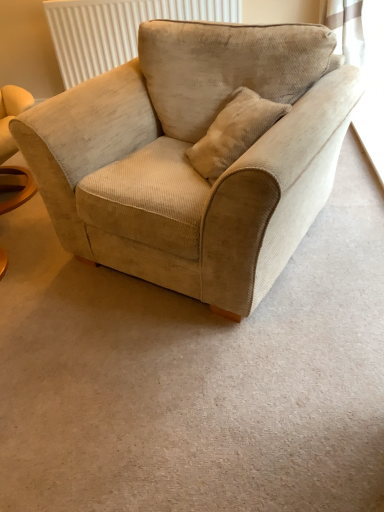
This screenshot has height=512, width=384. What do you see at coordinates (187, 161) in the screenshot? I see `beige corduroy armchair at center` at bounding box center [187, 161].

What are the coordinates of `beige corduroy armchair at center` in the screenshot? It's located at (187, 161).

In order to click on white textured radiator at upper center in this screenshot , I will do `click(117, 29)`.

This screenshot has height=512, width=384. What do you see at coordinates (117, 29) in the screenshot? I see `white textured radiator at upper center` at bounding box center [117, 29].

The image size is (384, 512). In order to click on beige corduroy armchair at center in this screenshot , I will do coord(187,161).

Which is more to the right, white textured radiator at upper center or beige corduroy armchair at center?

beige corduroy armchair at center.

Is white textured radiator at upper center positioned in front of beige corduroy armchair at center?

No.

Is point (135, 28) positioned before point (316, 209)?

No, (135, 28) is further to viewer.

From the image's perspective, relative to beige corduroy armchair at center, is white textured radiator at upper center above or below?

white textured radiator at upper center is situated higher than beige corduroy armchair at center in the image.

From a real-world perspective, which is physically below, white textured radiator at upper center or beige corduroy armchair at center?

In real-world perspective, beige corduroy armchair at center is lower.

Considering the relative sizes of white textured radiator at upper center and beige corduroy armchair at center in the image provided, is white textured radiator at upper center wider than beige corduroy armchair at center?

No.

Who is taller, white textured radiator at upper center or beige corduroy armchair at center?

With more height is beige corduroy armchair at center.

Can you confirm if white textured radiator at upper center is smaller than beige corduroy armchair at center?

Indeed, white textured radiator at upper center has a smaller size compared to beige corduroy armchair at center.

Is white textured radiator at upper center inside the boundaries of beige corduroy armchair at center, or outside?

The correct answer is: outside.

Is white textured radiator at upper center positioned far away from beige corduroy armchair at center?

Indeed, white textured radiator at upper center is not near beige corduroy armchair at center.

Does white textured radiator at upper center turn towards beige corduroy armchair at center?

Yes, white textured radiator at upper center is facing beige corduroy armchair at center.

How many degrees apart are the facing directions of white textured radiator at upper center and beige corduroy armchair at center?

25.7 degrees separate the facing orientations of white textured radiator at upper center and beige corduroy armchair at center.

How distant is white textured radiator at upper center from beige corduroy armchair at center?

white textured radiator at upper center and beige corduroy armchair at center are 1.66 meters apart.

Locate an element on the screen. chair in front of the white textured radiator at upper center is located at coordinates (187, 161).

Is beige corduroy armchair at center at the left side of white textured radiator at upper center?

Incorrect, beige corduroy armchair at center is not on the left side of white textured radiator at upper center.

Is beige corduroy armchair at center positioned before white textured radiator at upper center?

Yes, the depth of beige corduroy armchair at center is less than that of white textured radiator at upper center.

Between point (148, 129) and point (143, 6), which one is positioned in front?

Positioned in front is point (148, 129).

From the image's perspective, which is above, beige corduroy armchair at center or white textured radiator at upper center?

white textured radiator at upper center appears higher in the image.

From a real-world perspective, is beige corduroy armchair at center positioned over white textured radiator at upper center based on gravity?

No.

Is beige corduroy armchair at center wider or thinner than white textured radiator at upper center?

In the image, beige corduroy armchair at center appears to be wider than white textured radiator at upper center.

Is beige corduroy armchair at center taller or shorter than white textured radiator at upper center?

Considering their sizes, beige corduroy armchair at center has more height than white textured radiator at upper center.

In terms of size, does beige corduroy armchair at center appear bigger or smaller than white textured radiator at upper center?

In the image, beige corduroy armchair at center appears to be larger than white textured radiator at upper center.

Can white textured radiator at upper center be found inside beige corduroy armchair at center?

No, white textured radiator at upper center is not a part of beige corduroy armchair at center.

Is beige corduroy armchair at center in contact with white textured radiator at upper center?

No, beige corduroy armchair at center is not in contact with white textured radiator at upper center.

Could you tell me if beige corduroy armchair at center is facing white textured radiator at upper center?

No, beige corduroy armchair at center is not oriented towards white textured radiator at upper center.

Measure the distance between beige corduroy armchair at center and white textured radiator at upper center.

The distance of beige corduroy armchair at center from white textured radiator at upper center is 1.66 meters.

This screenshot has height=512, width=384. Identify the location of chair that is in front of the white textured radiator at upper center. (187, 161).

The height and width of the screenshot is (512, 384). Find the location of `chair located underneath the white textured radiator at upper center (from a real-world perspective)`. chair located underneath the white textured radiator at upper center (from a real-world perspective) is located at coordinates (187, 161).

The height and width of the screenshot is (512, 384). I want to click on radiator above the beige corduroy armchair at center (from a real-world perspective), so click(117, 29).